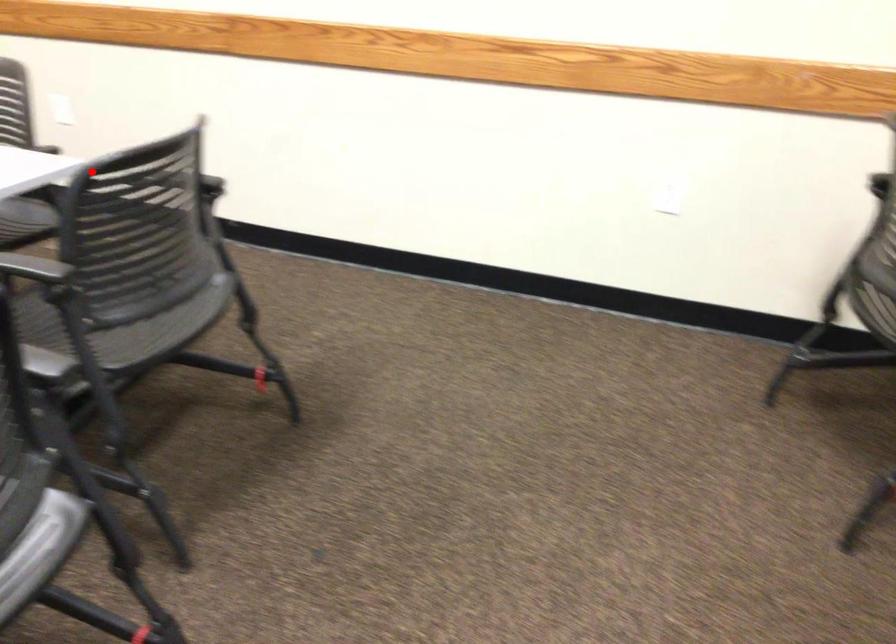
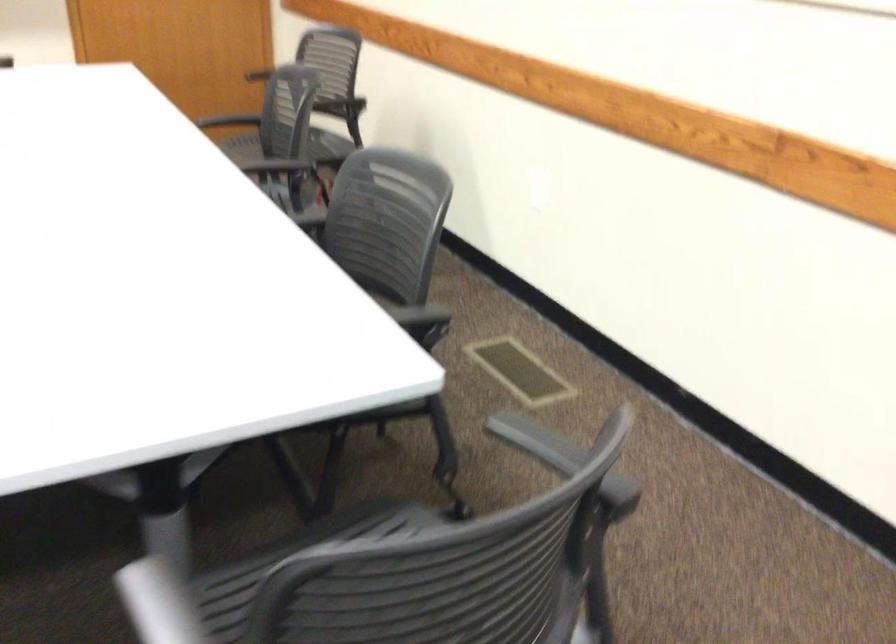
Find the pixel in the second image that matches the highlighted location in the first image.

(293, 560)